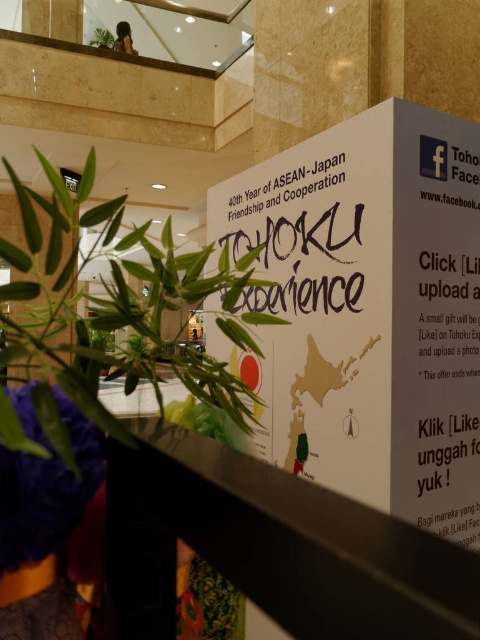
Question: Does white paper sign at center appear over green leafy plant at lower left?

Choices:
 (A) yes
 (B) no

Answer: (B)

Question: Is white paper sign at center above green leafy plant at lower left?

Choices:
 (A) no
 (B) yes

Answer: (A)

Question: Where is white paper sign at center located in relation to green leafy plant at lower left in the image?

Choices:
 (A) left
 (B) right

Answer: (B)

Question: Which point appears farthest from the camera in this image?

Choices:
 (A) (144, 364)
 (B) (328, 243)

Answer: (B)